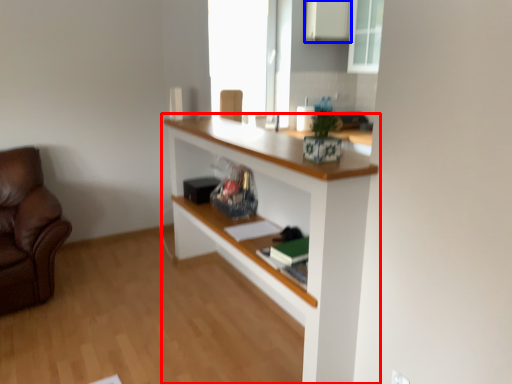
Question: Among these objects, which one is nearest to the camera, shelf (highlighted by a red box) or cabinetry (highlighted by a blue box)?

Choices:
 (A) shelf
 (B) cabinetry

Answer: (A)